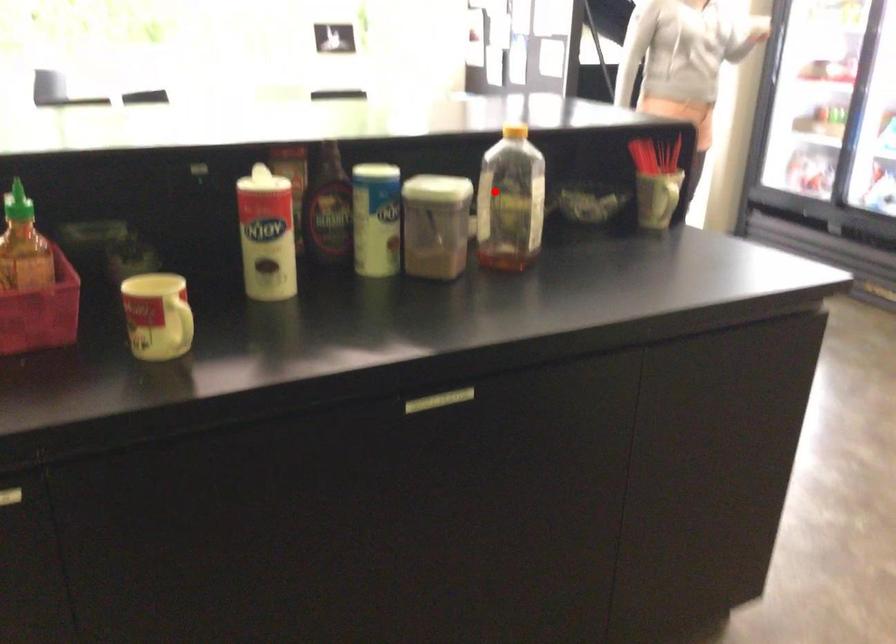
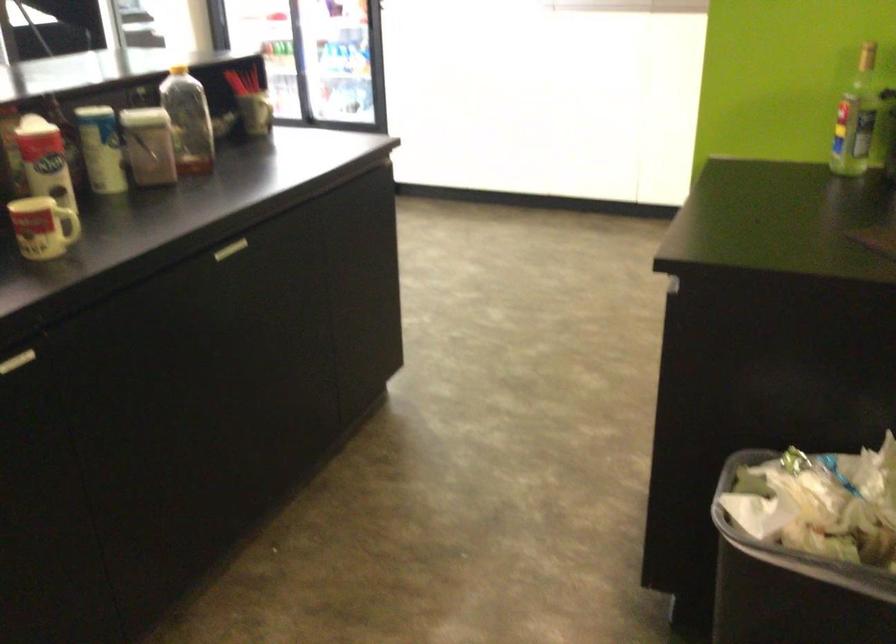
Locate, in the second image, the point that corresponds to the highlighted location in the first image.

(187, 120)